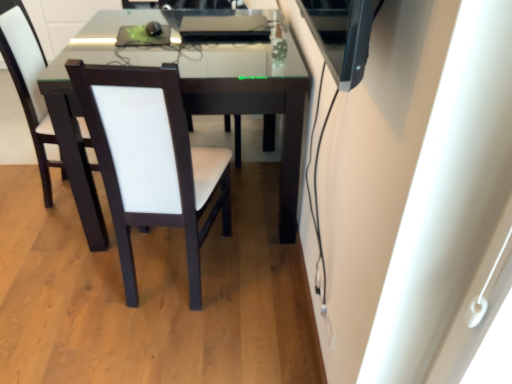
Where is `free spot to the right of white leather chair at center, which ranks as the 2th chair in right-to-left order`? The height and width of the screenshot is (384, 512). free spot to the right of white leather chair at center, which ranks as the 2th chair in right-to-left order is located at coordinates (261, 284).